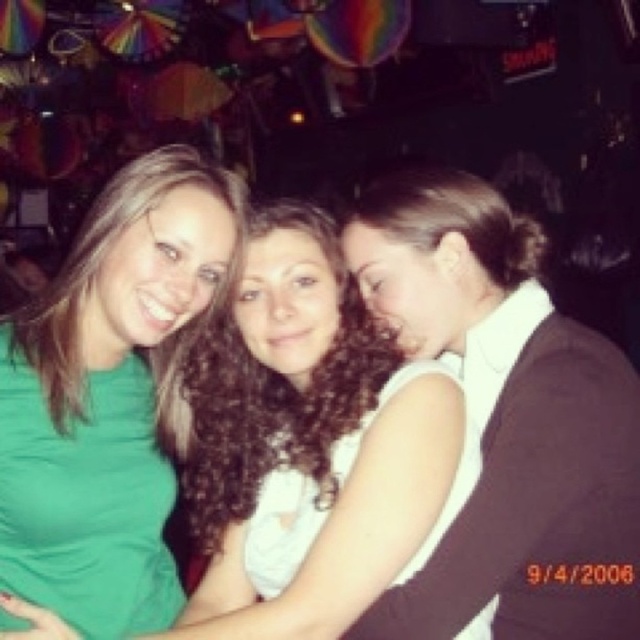
Question: Is curly hair at center to the left of green matte shirt at left from the viewer's perspective?

Choices:
 (A) no
 (B) yes

Answer: (A)

Question: Which point appears closest to the camera in this image?

Choices:
 (A) tap(221, 436)
 (B) tap(150, 554)

Answer: (B)

Question: Which of the following is the farthest from the observer?

Choices:
 (A) green matte shirt at left
 (B) curly hair at center

Answer: (A)

Question: Can you confirm if curly hair at center is positioned to the left of green matte shirt at left?

Choices:
 (A) no
 (B) yes

Answer: (A)

Question: Is curly hair at center further to camera compared to green matte shirt at left?

Choices:
 (A) no
 (B) yes

Answer: (A)

Question: Which of the following is the closest to the observer?

Choices:
 (A) curly hair at center
 (B) green matte shirt at left

Answer: (A)